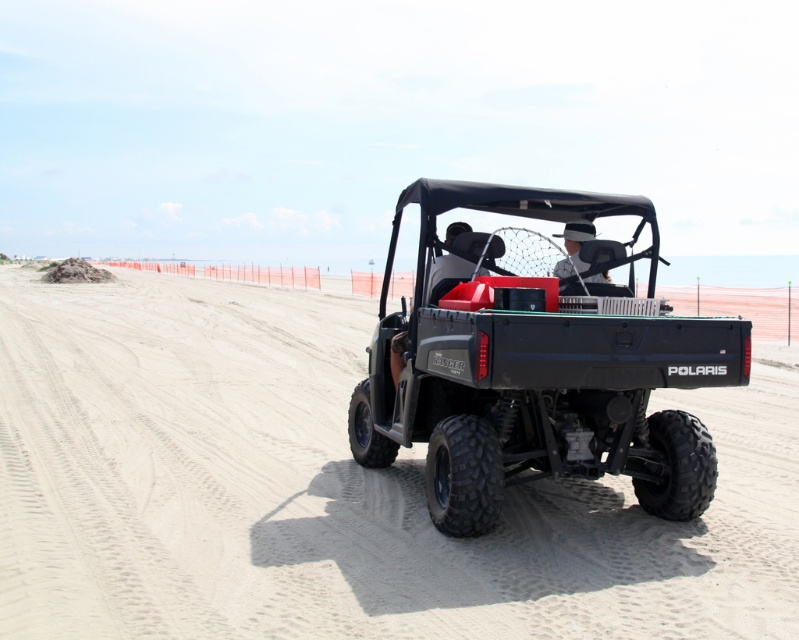
Question: Is sandy dirt track at center wider than matte black utility vehicle at center?

Choices:
 (A) no
 (B) yes

Answer: (B)

Question: Which point is farther to the camera?

Choices:
 (A) (559, 291)
 (B) (573, 253)
 (C) (745, 518)

Answer: (B)

Question: Does sandy dirt track at center appear over matte black utility vehicle at center?

Choices:
 (A) no
 (B) yes

Answer: (B)

Question: Is sandy dirt track at center smaller than white fabric hat at center?

Choices:
 (A) no
 (B) yes

Answer: (A)

Question: Which of the following is the closest to the observer?

Choices:
 (A) (466, 369)
 (B) (571, 234)

Answer: (A)

Question: Which point is closer to the camera?

Choices:
 (A) (566, 224)
 (B) (754, 545)

Answer: (B)